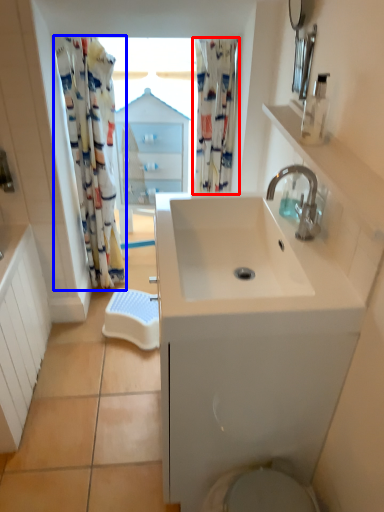
Question: Which object appears closest to the camera in this image, shower curtain (highlighted by a red box) or shower curtain (highlighted by a blue box)?

Choices:
 (A) shower curtain
 (B) shower curtain

Answer: (B)